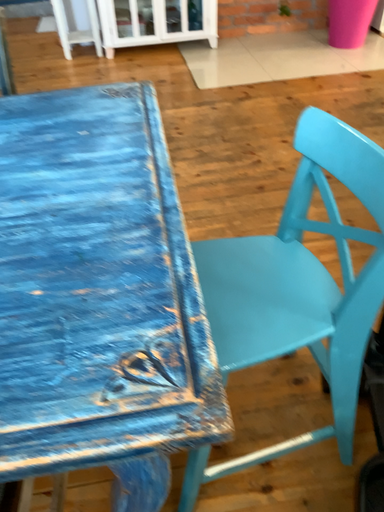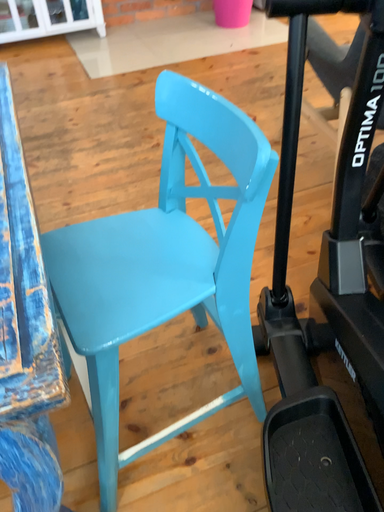
Question: Which way did the camera rotate in the video?

Choices:
 (A) rotated right
 (B) rotated left

Answer: (A)